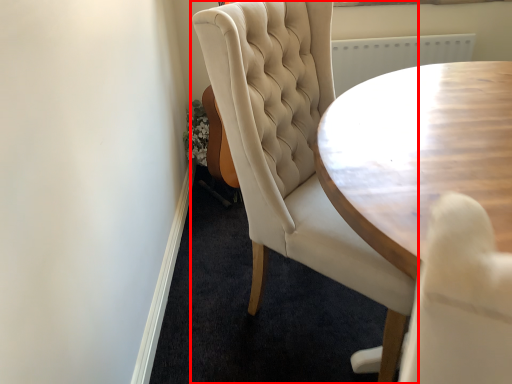
Question: Where is chair (annotated by the red box) located in relation to coffee table in the image?

Choices:
 (A) left
 (B) right

Answer: (A)